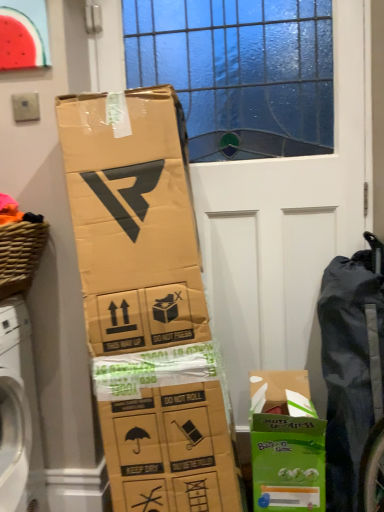
Question: Can you confirm if watermelon matte plastic at upper left is thinner than woven brown basket at left?

Choices:
 (A) yes
 (B) no

Answer: (A)

Question: Can woven brown basket at left be found inside watermelon matte plastic at upper left?

Choices:
 (A) no
 (B) yes

Answer: (A)

Question: Is watermelon matte plastic at upper left smaller than woven brown basket at left?

Choices:
 (A) no
 (B) yes

Answer: (B)

Question: Can you confirm if watermelon matte plastic at upper left is shorter than woven brown basket at left?

Choices:
 (A) yes
 (B) no

Answer: (B)

Question: Does watermelon matte plastic at upper left touch woven brown basket at left?

Choices:
 (A) yes
 (B) no

Answer: (B)

Question: Based on their positions, is black fabric bag at right located to the left or right of woven brown basket at left?

Choices:
 (A) right
 (B) left

Answer: (A)

Question: Considering the positions of black fabric bag at right and woven brown basket at left in the image, is black fabric bag at right wider or thinner than woven brown basket at left?

Choices:
 (A) thin
 (B) wide

Answer: (B)

Question: Relative to woven brown basket at left, is black fabric bag at right in front or behind?

Choices:
 (A) front
 (B) behind

Answer: (B)

Question: Is point (360, 395) positioned closer to the camera than point (16, 287)?

Choices:
 (A) farther
 (B) closer

Answer: (B)

Question: Considering the positions of point (24, 234) and point (380, 259), is point (24, 234) closer or farther from the camera than point (380, 259)?

Choices:
 (A) farther
 (B) closer

Answer: (B)

Question: In terms of width, does woven brown basket at left look wider or thinner when compared to black fabric bag at right?

Choices:
 (A) wide
 (B) thin

Answer: (B)

Question: Considering their positions, is woven brown basket at left located in front of or behind black fabric bag at right?

Choices:
 (A) behind
 (B) front

Answer: (B)

Question: Is woven brown basket at left taller or shorter than black fabric bag at right?

Choices:
 (A) tall
 (B) short

Answer: (B)

Question: From their relative heights in the image, would you say woven brown basket at left is taller or shorter than green cardboard box at lower right?

Choices:
 (A) short
 (B) tall

Answer: (A)

Question: Looking at their shapes, would you say woven brown basket at left is wider or thinner than green cardboard box at lower right?

Choices:
 (A) wide
 (B) thin

Answer: (B)